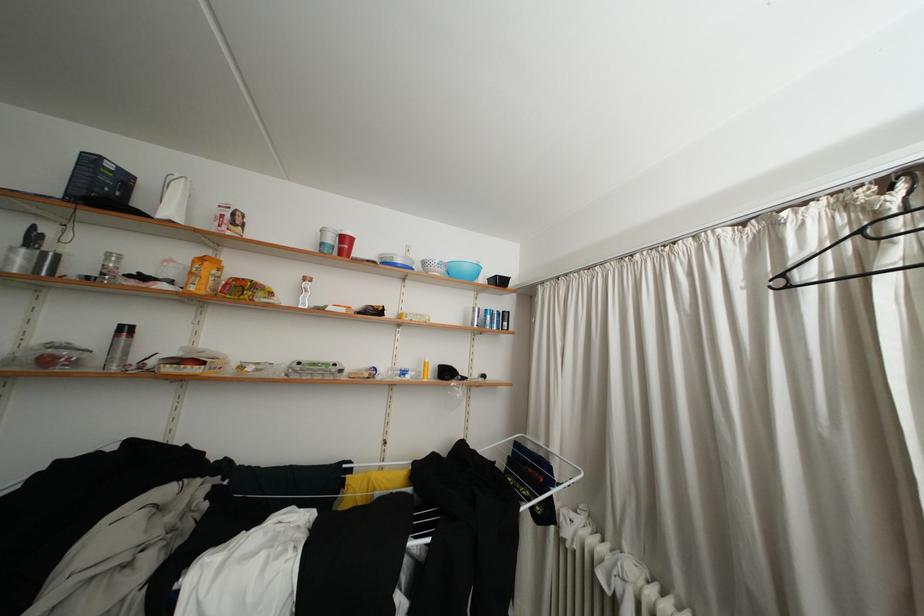
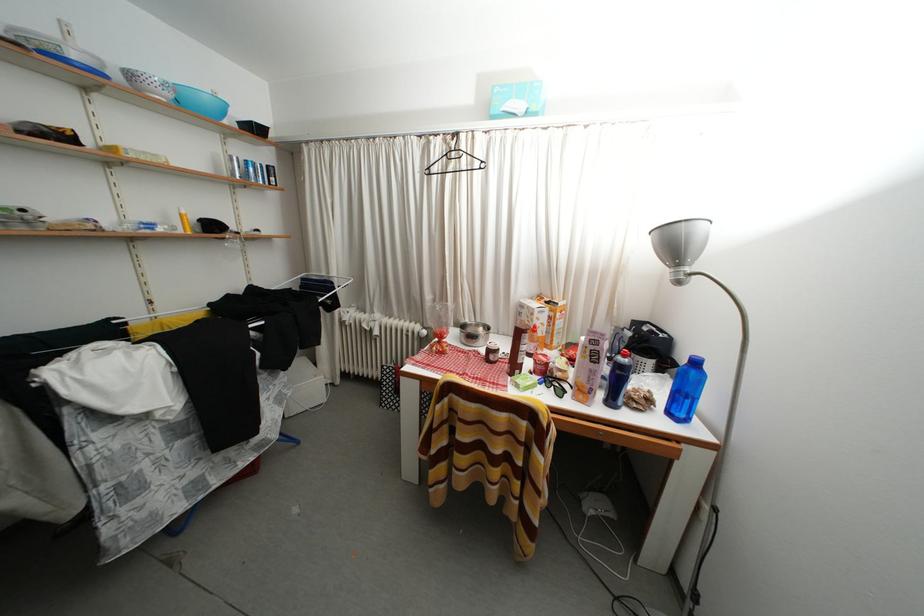
Find the pixel in the second image that matches (x=451, y=276) in the first image.

(178, 100)